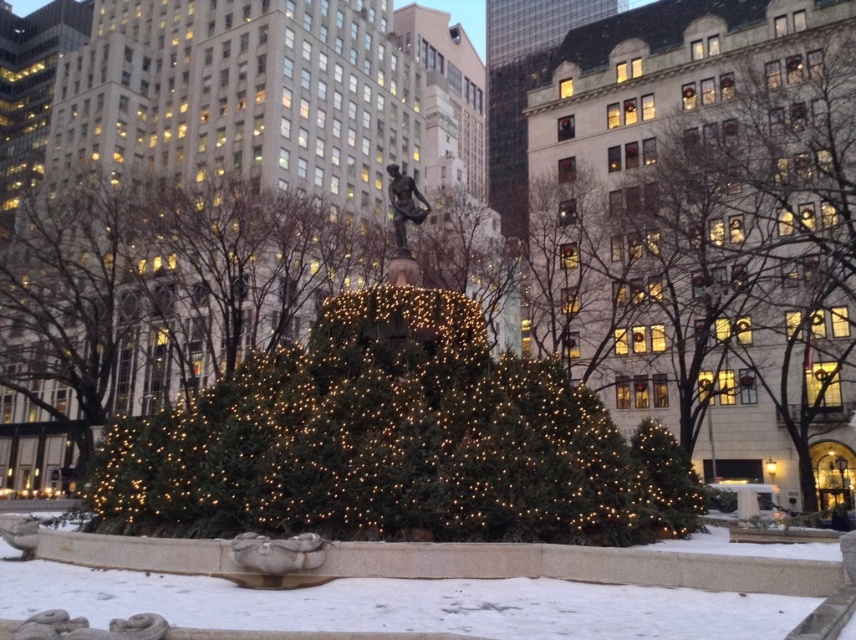
Does green matte christmas tree at center have a smaller size compared to white snow at center?

No.

Locate an element on the screen. Image resolution: width=856 pixels, height=640 pixels. green matte christmas tree at center is located at coordinates (394, 442).